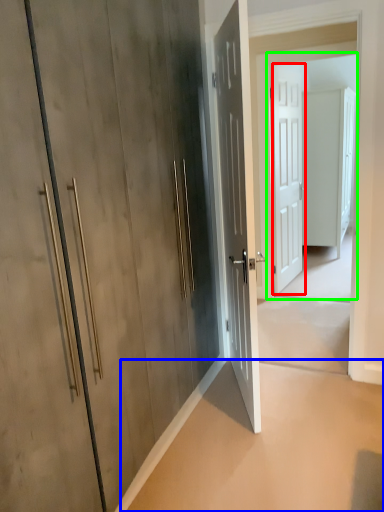
Question: Estimate the real-world distances between objects in this image. Which object is farther from door (highlighted by a red box), concrete (highlighted by a blue box) or screen door (highlighted by a green box)?

Choices:
 (A) concrete
 (B) screen door

Answer: (A)